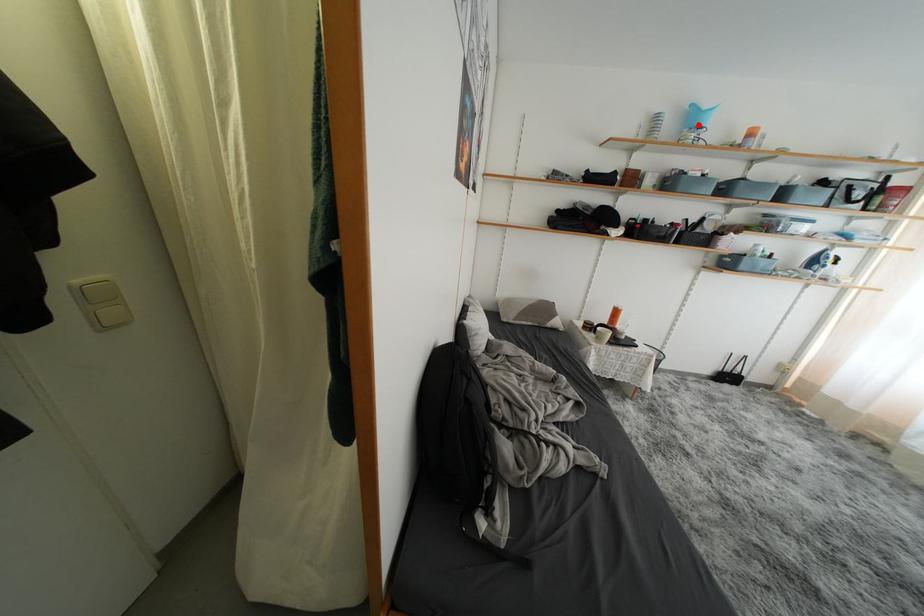
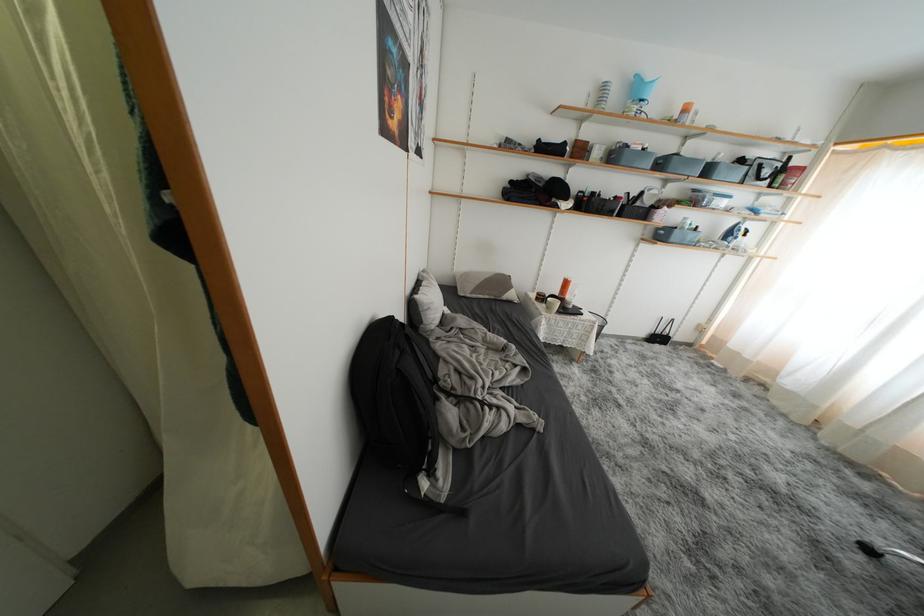
The point at the highlighted location is marked in the first image. Where is the corresponding point in the second image?

(642, 97)